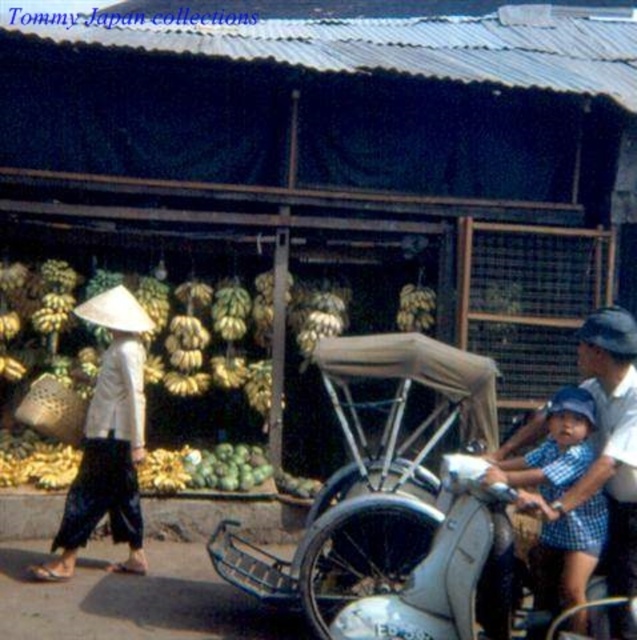
Who is shorter, white matte conical hat at left or blue checkered dress at center?

With less height is blue checkered dress at center.

Who is positioned more to the right, white matte conical hat at left or blue checkered dress at center?

blue checkered dress at center is more to the right.

Who is more forward, (62, 545) or (561, 406)?

Positioned in front is point (561, 406).

Image resolution: width=637 pixels, height=640 pixels. Identify the location of white matte conical hat at left. (108, 442).